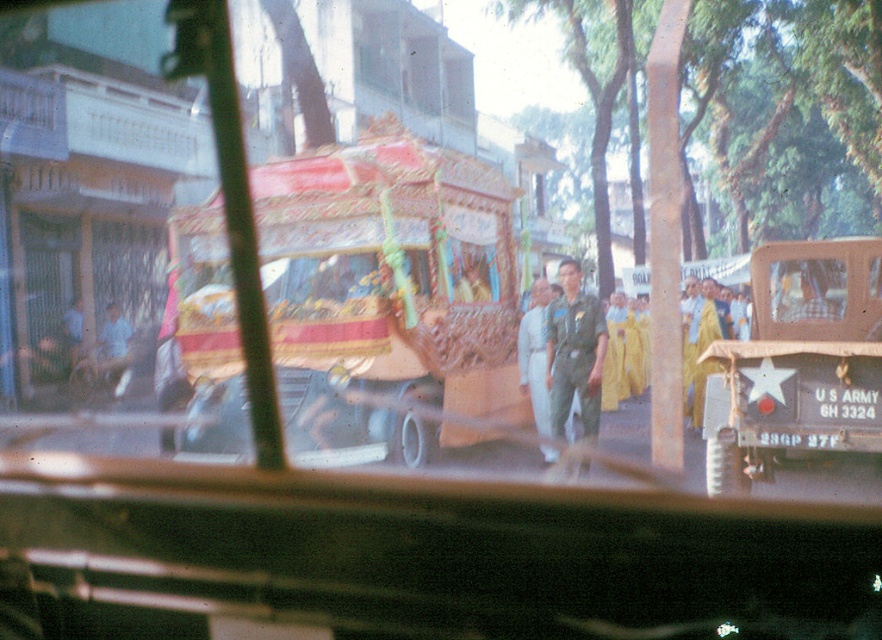
The height and width of the screenshot is (640, 882). What do you see at coordinates (797, 362) in the screenshot? I see `camouflage fabric food truck at right` at bounding box center [797, 362].

Does camouflage fabric food truck at right lie in front of green uniform at center?

Yes, camouflage fabric food truck at right is in front of green uniform at center.

This screenshot has width=882, height=640. Identify the location of camouflage fabric food truck at right. (797, 362).

Find the location of a particular element. This screenshot has width=882, height=640. camouflage fabric food truck at right is located at coordinates (797, 362).

Is decorative wood cart at center below light blue uniform at center?

Actually, decorative wood cart at center is above light blue uniform at center.

Is point (499, 260) closer to viewer compared to point (544, 429)?

No, it is behind (544, 429).

Does point (378, 305) lie behind point (537, 326)?

No, it is not.

Image resolution: width=882 pixels, height=640 pixels. Identify the location of decorative wood cart at center. 386,291.

Who is positioned more to the left, decorative wood cart at center or green uniform at center?

decorative wood cart at center

Does decorative wood cart at center come in front of green uniform at center?

No, decorative wood cart at center is behind green uniform at center.

Who is more forward, (318, 368) or (589, 420)?

Point (589, 420) is more forward.

Where is `decorative wood cart at center`? decorative wood cart at center is located at coordinates (386, 291).